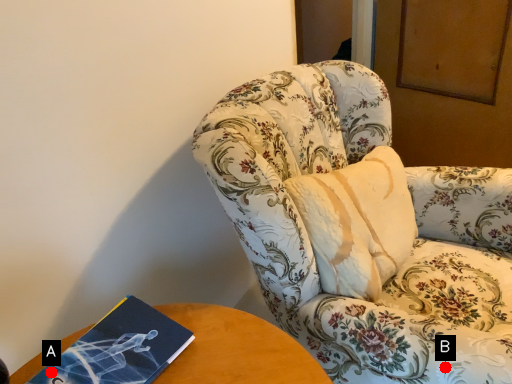
Question: Two points are circled on the image, labeled by A and B beside each circle. Which point appears farthest from the camera in this image?

Choices:
 (A) A is further
 (B) B is further

Answer: (B)